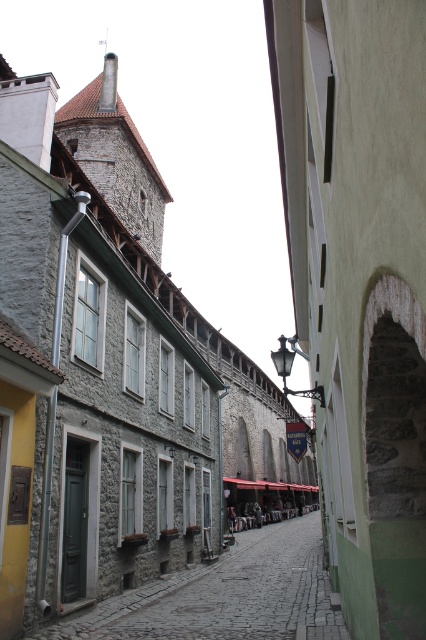
Question: Does smooth stone arch at center have a lesser width compared to stone paved alley at center?

Choices:
 (A) no
 (B) yes

Answer: (B)

Question: Which of the following is the farthest from the observer?

Choices:
 (A) (299, 243)
 (B) (198, 564)

Answer: (B)

Question: Is smooth stone arch at center below stone paved alley at center?

Choices:
 (A) yes
 (B) no

Answer: (B)

Question: Where is smooth stone arch at center located in relation to stone paved alley at center in the image?

Choices:
 (A) below
 (B) above

Answer: (B)

Question: Which point is closer to the camera?

Choices:
 (A) [172, 582]
 (B) [402, 490]

Answer: (B)

Question: Which of the following is the farthest from the observer?

Choices:
 (A) stone paved alley at center
 (B) smooth stone arch at center

Answer: (A)